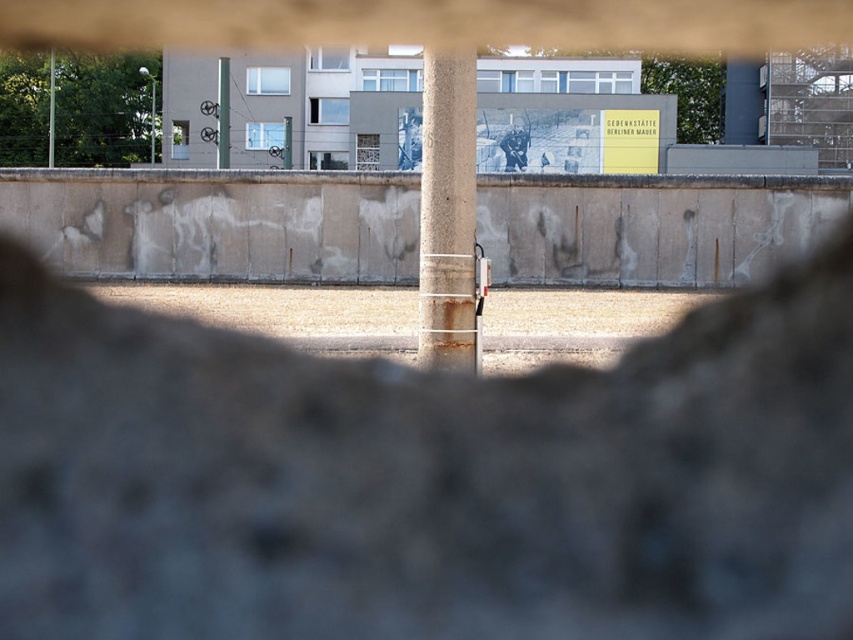
You are standing at the low vantage point shown in the image and want to identify the pole that is closer to you. Which pole is it? The smooth concrete pole at center or the green metallic pole at center?

The smooth concrete pole at center is positioned over the green metallic pole at center, so the smooth concrete pole at center is closer to you.

You are standing at the center of the image and want to locate the rusty concrete pillar at center. According to the coordinates given, where exactly is it positioned?

The rusty concrete pillar at center is located at point 0.331 on the x axis and 0.525 on the y axis.

Based on the photo, you are a maintenance worker inspecting the area through a narrow gap between two concrete structures. You notice a point marked at coordinates [51,112]. What object is located at this point?

The point at [51,112] indicates the smooth concrete pole at center.